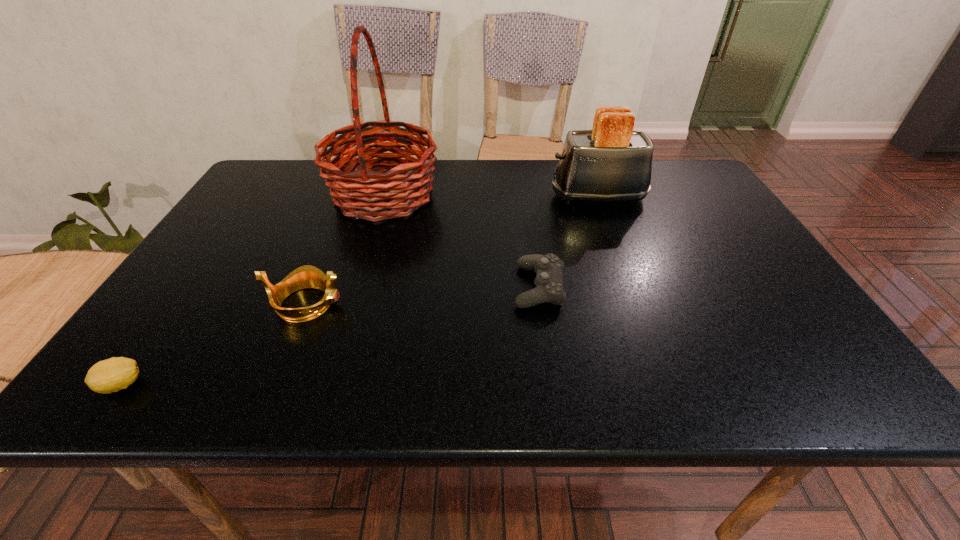
Find the location of a particular element. The image size is (960, 540). free point between the fourth shortest object and the tiara is located at coordinates (452, 250).

Identify the location of free area in between the second object from right to left and the tallest object. (462, 241).

Where is `vacant area between the basket and the second object from right to left`? This screenshot has width=960, height=540. vacant area between the basket and the second object from right to left is located at coordinates (462, 241).

You are a GUI agent. You are given a task and a screenshot of the screen. Output one action in this format:
    pyautogui.click(x=<x>, y=<y>)
    Task: Click on the fourth closest object to the tiara
    The height and width of the screenshot is (540, 960).
    Given the screenshot: What is the action you would take?
    pyautogui.click(x=612, y=162)

Select which object is the third closest to the control. Please provide its 2D coordinates. Your answer should be formatted as a tuple, i.e. [(x, y)], where the tuple contains the x and y coordinates of a point satisfying the conditions above.

[(307, 276)]

This screenshot has height=540, width=960. I want to click on vacant space that satisfies the following two spatial constraints: 1. on the handle side of the tallest object; 2. on the back side of the control, so click(x=356, y=287).